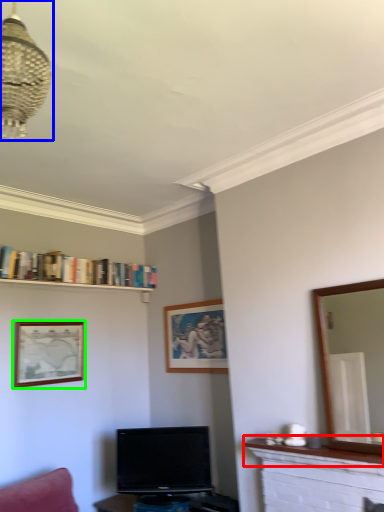
Question: Estimate the real-world distances between objects in this image. Which object is farther from mantle (highlighted by a red box), light fixture (highlighted by a blue box) or picture frame (highlighted by a green box)?

Choices:
 (A) light fixture
 (B) picture frame

Answer: (A)